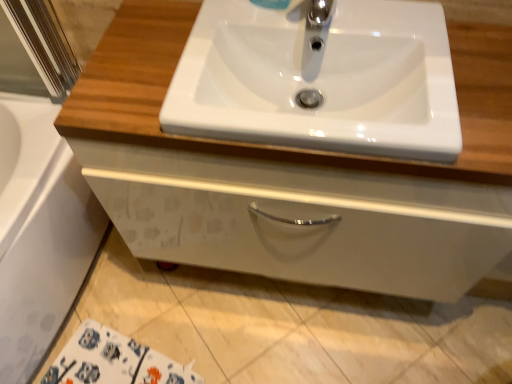
Find the location of a particular element. The height and width of the screenshot is (384, 512). empty space that is ontop of white glossy sink at center (from a real-world perspective) is located at coordinates (321, 29).